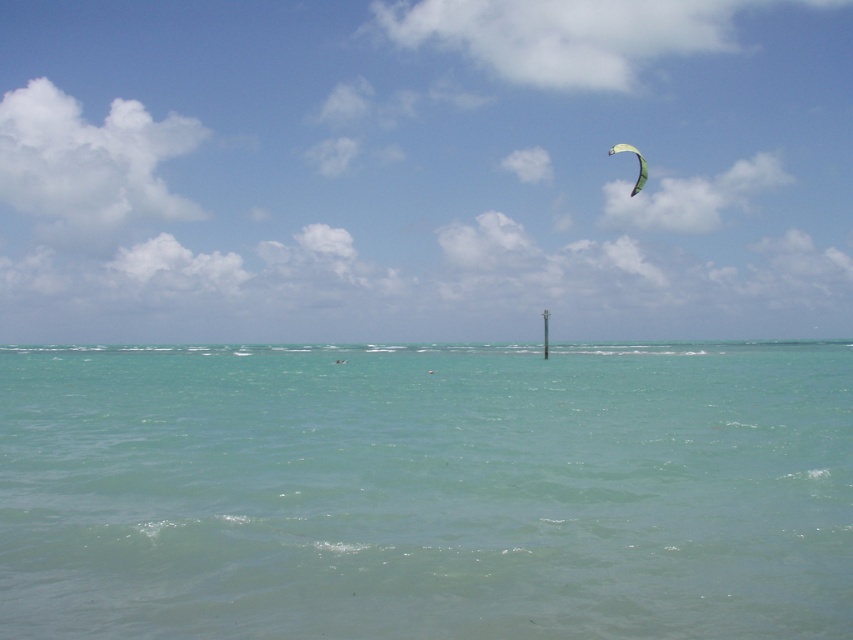
You are a photographer standing on the beach and want to capture both the transparent kite at upper center and the green fabric parachute at upper right in your shot. Which object will appear larger in the photo?

The transparent kite at upper center will appear larger in the photo because it is closer to the viewer than the green fabric parachute at upper right.

You are standing at the shore looking out at the water and the kite. There are two points marked in the image. Which of the two points, point (809, 573) or point (645, 176), is closer to you?

Point (809, 573) is closer to you than point (645, 176).

You are a photographer planning to take a photo of the transparent kite at upper center and the green fabric parachute at upper right. Which object should you focus on first if you want to capture both in one frame without moving the camera?

The transparent kite at upper center should be focused on first because it has a greater height compared to the green fabric parachute at upper right, allowing it to be in the frame while adjusting focus to include the lower positioned parachute.